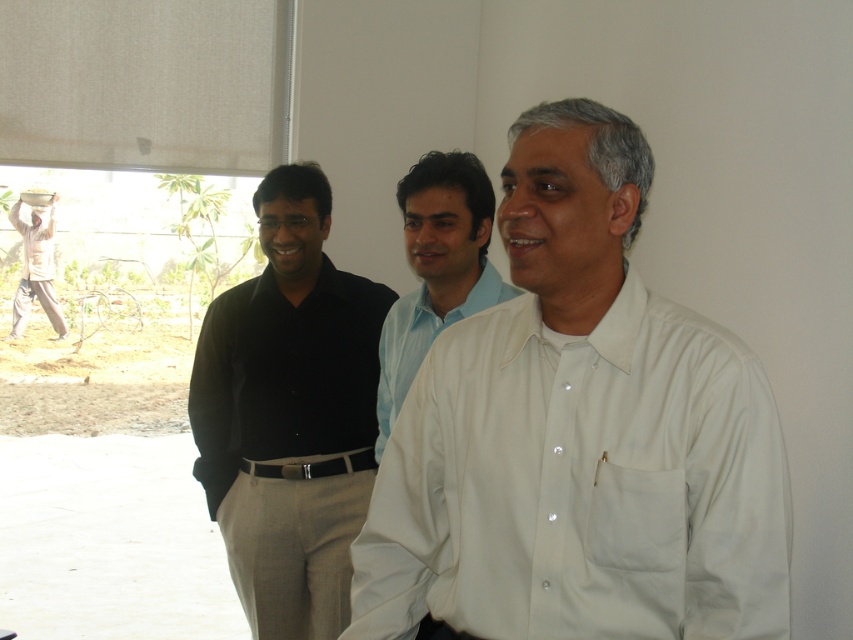
You are a photographer adjusting the camera settings to ensure all subjects are in focus. Given that the light blue cotton shirt at center and the light beige cotton shirt at left are at different heights, which one might require you to adjust the focus more carefully to avoid blurriness?

The light blue cotton shirt at center has a lesser height compared to the light beige cotton shirt at left. Therefore, the light blue cotton shirt at center might require more careful focus adjustment due to its lower position in the frame.